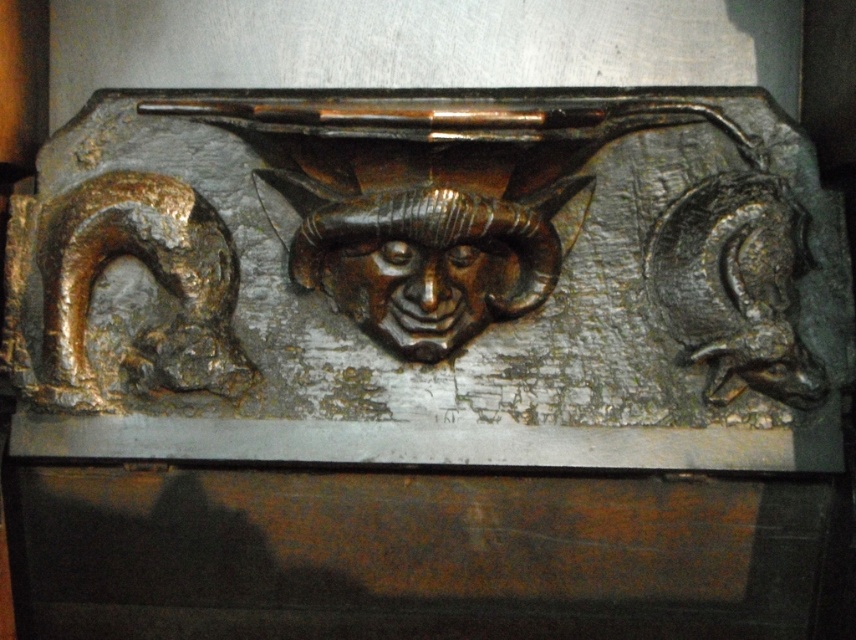
You are an interior designer assessing the placement of two masks in a room. The scene shows a decorative metal piece with the bronze textured mask at center and the shiny bronze mask at center. Which mask is positioned higher in the scene?

The bronze textured mask at center is located above the shiny bronze mask at center, so it is positioned higher in the scene.

You are an art restorer examining the decorative metal piece. You notice two central elements, the bronze textured face at center and the shiny bronze mask at center. Which one is taller?

The bronze textured face at center is taller than the shiny bronze mask at center.